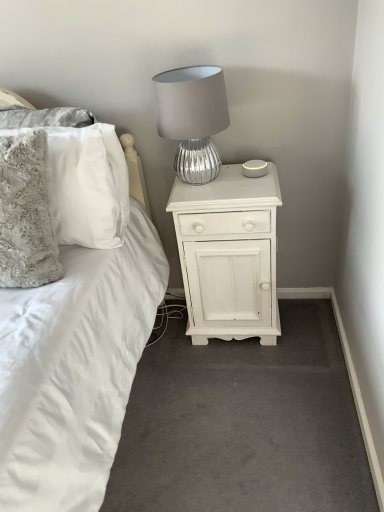
Locate an element on the screen. vacant region in front of white painted wood nightstand at center is located at coordinates (244, 386).